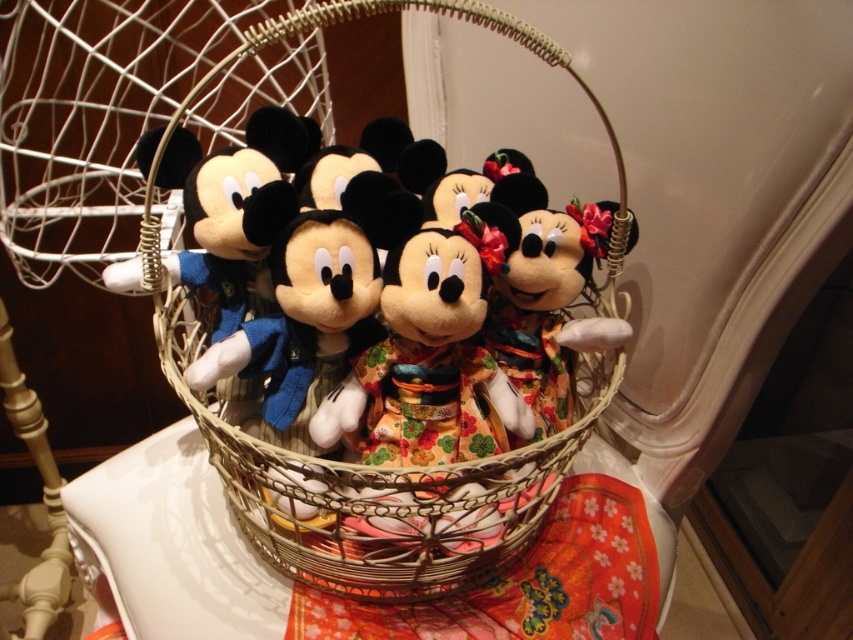
Question: Is woven straw basket at center to the left of white glossy table at center from the viewer's perspective?

Choices:
 (A) yes
 (B) no

Answer: (B)

Question: Can you confirm if woven straw basket at center is positioned to the right of white glossy table at center?

Choices:
 (A) no
 (B) yes

Answer: (B)

Question: Does woven straw basket at center have a greater width compared to white glossy table at center?

Choices:
 (A) yes
 (B) no

Answer: (A)

Question: Which point is closer to the camera?

Choices:
 (A) woven straw basket at center
 (B) white glossy table at center

Answer: (A)

Question: Among these objects, which one is nearest to the camera?

Choices:
 (A) white glossy table at center
 (B) woven straw basket at center

Answer: (B)